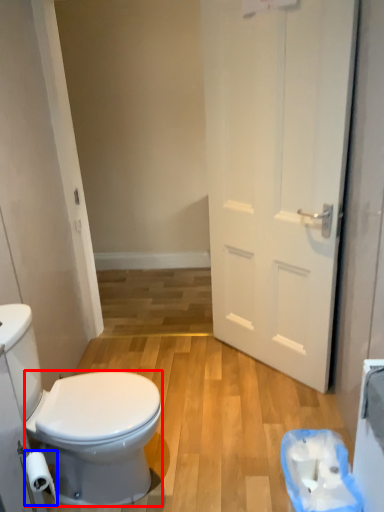
Question: Which of the following is the farthest to the observer, bidet (highlighted by a red box) or toilet paper (highlighted by a blue box)?

Choices:
 (A) bidet
 (B) toilet paper

Answer: (A)